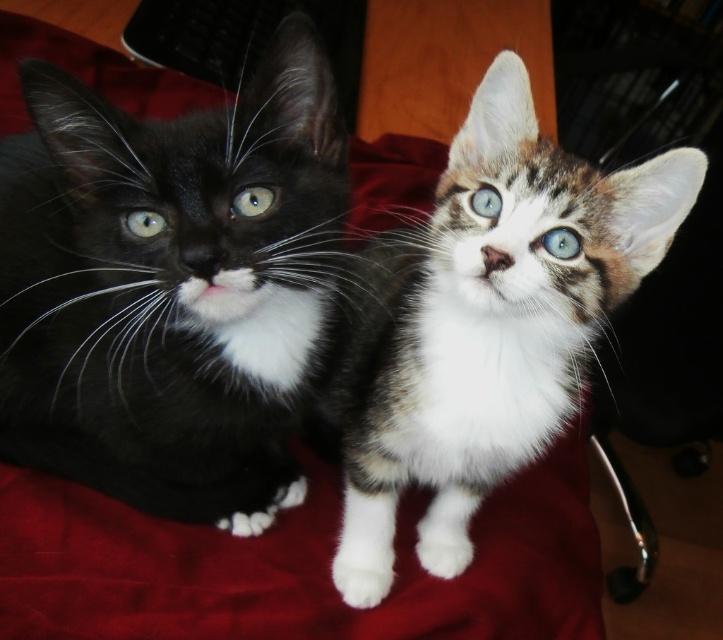
Question: Which point is closer to the camera?

Choices:
 (A) green glossy eye at left
 (B) blue glossy eye at upper center
 (C) black glossy fur cat at left

Answer: (C)

Question: Which is farther from the black glossy fur cat at left?

Choices:
 (A) green glossy eye at center
 (B) blue glossy eye at center
 (C) tabby fur kitten at center

Answer: (B)

Question: Observing the image, what is the correct spatial positioning of black glossy fur cat at left in reference to tabby fur kitten at center?

Choices:
 (A) below
 (B) above

Answer: (B)

Question: From the image, what is the correct spatial relationship of black glossy fur cat at left in relation to green glossy eye at left?

Choices:
 (A) right
 (B) left

Answer: (B)

Question: Which object is closer to the camera taking this photo?

Choices:
 (A) tabby fur kitten at center
 (B) green glossy eye at left
 (C) blue glossy eye at center

Answer: (A)

Question: Does green glossy eye at left have a larger size compared to blue glossy eye at upper center?

Choices:
 (A) no
 (B) yes

Answer: (A)